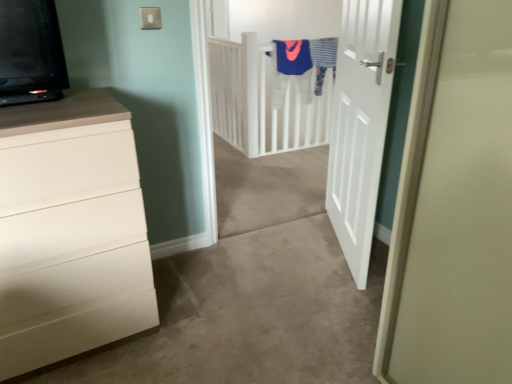
Question: Is white matte chest of drawers at left looking in the opposite direction of white matte door at center?

Choices:
 (A) yes
 (B) no

Answer: (B)

Question: Can you confirm if white matte chest of drawers at left is wider than white matte door at center?

Choices:
 (A) yes
 (B) no

Answer: (A)

Question: From the image's perspective, is white matte chest of drawers at left above white matte door at center?

Choices:
 (A) yes
 (B) no

Answer: (B)

Question: Is white matte door at center inside white matte chest of drawers at left?

Choices:
 (A) yes
 (B) no

Answer: (B)

Question: From a real-world perspective, is white matte chest of drawers at left over white matte door at center?

Choices:
 (A) no
 (B) yes

Answer: (A)

Question: From a real-world perspective, is white matte chest of drawers at left above or below striped fabric at upper center?

Choices:
 (A) above
 (B) below

Answer: (B)

Question: Is white matte chest of drawers at left to the left or to the right of striped fabric at upper center in the image?

Choices:
 (A) right
 (B) left

Answer: (B)

Question: Based on their sizes in the image, would you say white matte chest of drawers at left is bigger or smaller than striped fabric at upper center?

Choices:
 (A) small
 (B) big

Answer: (B)

Question: Would you say white matte chest of drawers at left is inside or outside striped fabric at upper center?

Choices:
 (A) outside
 (B) inside

Answer: (A)

Question: Considering the positions of white matte chest of drawers at left and white matte door at center in the image, is white matte chest of drawers at left wider or thinner than white matte door at center?

Choices:
 (A) wide
 (B) thin

Answer: (A)

Question: Is white matte chest of drawers at left to the left or to the right of white matte door at center in the image?

Choices:
 (A) right
 (B) left

Answer: (B)

Question: Does point (24, 266) appear closer or farther from the camera than point (338, 188)?

Choices:
 (A) farther
 (B) closer

Answer: (B)

Question: From the image's perspective, is white matte chest of drawers at left positioned above or below white matte door at center?

Choices:
 (A) above
 (B) below

Answer: (B)

Question: Visually, is blue fabric robe at upper center positioned to the left or to the right of white matte door at center?

Choices:
 (A) left
 (B) right

Answer: (A)

Question: Is blue fabric robe at upper center taller or shorter than white matte door at center?

Choices:
 (A) short
 (B) tall

Answer: (A)